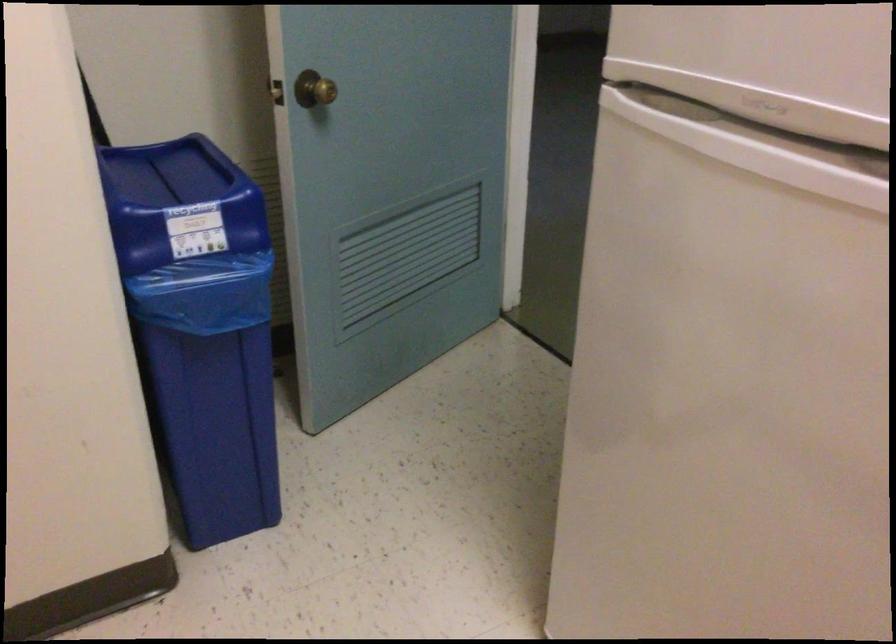
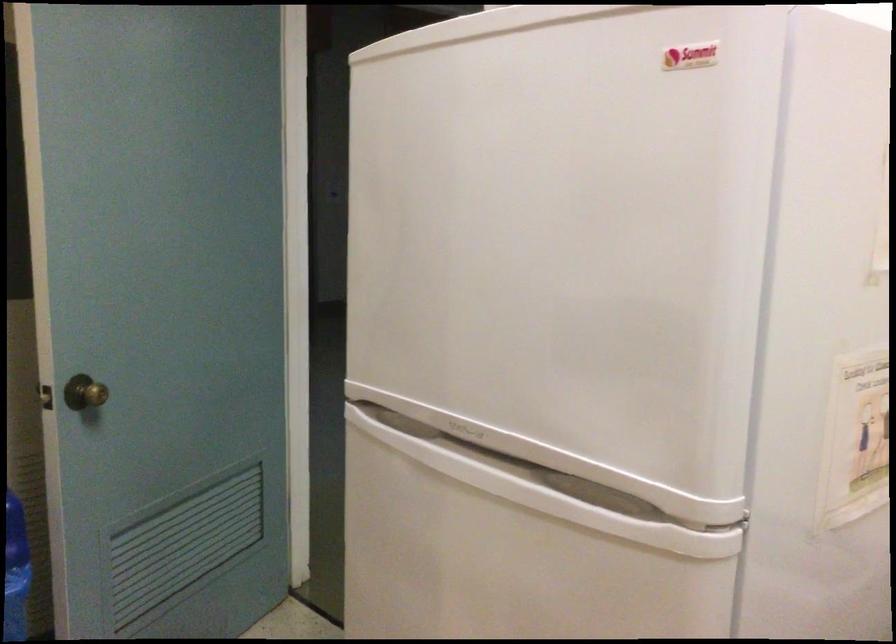
The point at (311, 93) is marked in the first image. Where is the corresponding point in the second image?

(85, 393)